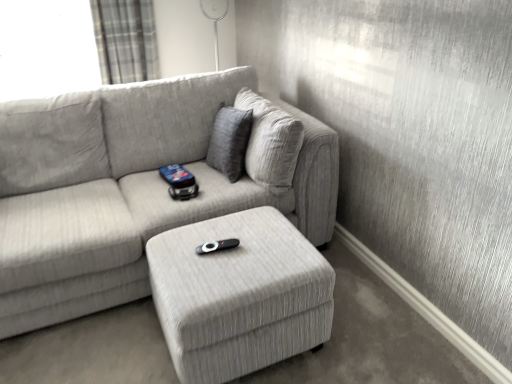
Question: Can you confirm if light gray fabric couch at center is taller than plaid fabric curtain at upper left?

Choices:
 (A) no
 (B) yes

Answer: (B)

Question: Is light gray fabric couch at center looking in the opposite direction of plaid fabric curtain at upper left?

Choices:
 (A) yes
 (B) no

Answer: (A)

Question: Does light gray fabric couch at center come behind plaid fabric curtain at upper left?

Choices:
 (A) yes
 (B) no

Answer: (B)

Question: Is plaid fabric curtain at upper left located within light gray fabric couch at center?

Choices:
 (A) yes
 (B) no

Answer: (B)

Question: Considering the relative sizes of light gray fabric couch at center and plaid fabric curtain at upper left in the image provided, is light gray fabric couch at center smaller than plaid fabric curtain at upper left?

Choices:
 (A) yes
 (B) no

Answer: (B)

Question: Visually, is black plastic remote at center positioned to the left or to the right of plaid fabric curtain at upper left?

Choices:
 (A) right
 (B) left

Answer: (A)

Question: From the image's perspective, relative to plaid fabric curtain at upper left, is black plastic remote at center above or below?

Choices:
 (A) above
 (B) below

Answer: (B)

Question: Is point (201, 246) positioned closer to the camera than point (138, 16)?

Choices:
 (A) closer
 (B) farther

Answer: (A)

Question: Looking at their shapes, would you say black plastic remote at center is wider or thinner than plaid fabric curtain at upper left?

Choices:
 (A) wide
 (B) thin

Answer: (B)

Question: Based on their sizes in the image, would you say black plastic remote at center is bigger or smaller than light gray fabric couch at center?

Choices:
 (A) small
 (B) big

Answer: (A)

Question: Is point (208, 251) positioned closer to the camera than point (146, 84)?

Choices:
 (A) farther
 (B) closer

Answer: (B)

Question: Relative to light gray fabric couch at center, is black plastic remote at center in front or behind?

Choices:
 (A) front
 (B) behind

Answer: (B)

Question: Do you think black plastic remote at center is within light gray fabric couch at center, or outside of it?

Choices:
 (A) inside
 (B) outside

Answer: (B)

Question: In the image, is light gray fabric couch at center positioned in front of or behind plaid fabric curtain at upper left?

Choices:
 (A) front
 (B) behind

Answer: (A)

Question: Based on their sizes in the image, would you say light gray fabric couch at center is bigger or smaller than plaid fabric curtain at upper left?

Choices:
 (A) small
 (B) big

Answer: (B)